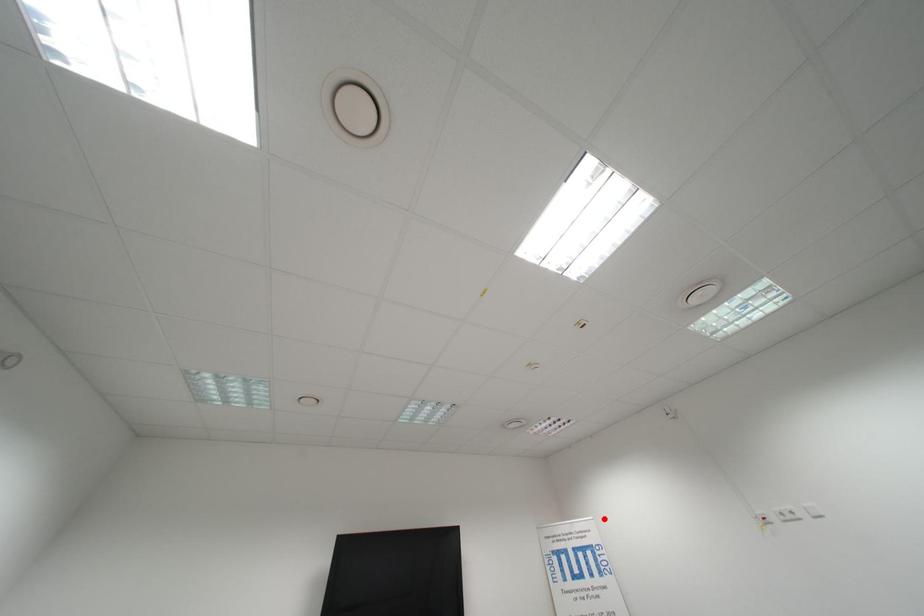
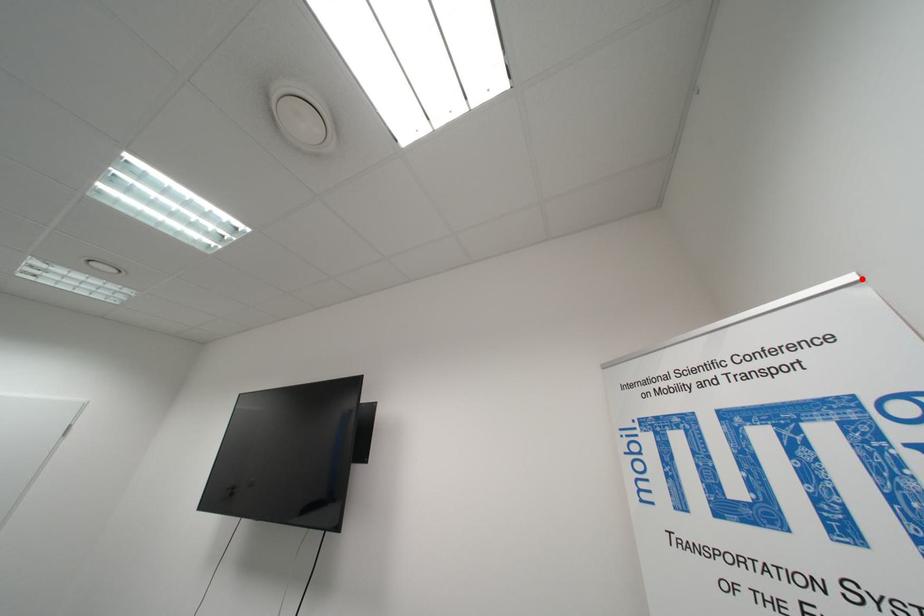
I am providing you with two images of the same scene from different viewpoints. A red point is marked on the first image and another point is marked on the second image. Are the points marked in image1 and image2 representing the same 3D position?

Yes